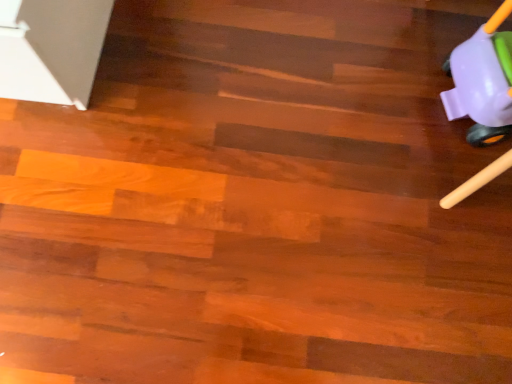
Where is `vacant space situated on the left part of purple plastic toy at upper right`? vacant space situated on the left part of purple plastic toy at upper right is located at coordinates (379, 99).